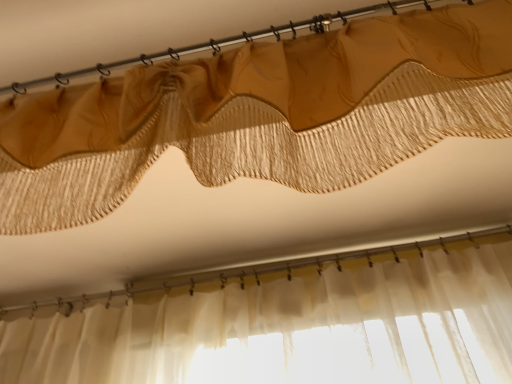
The image size is (512, 384). What do you see at coordinates (262, 114) in the screenshot? I see `matte gold curtain at upper center` at bounding box center [262, 114].

This screenshot has height=384, width=512. Identify the location of matte gold curtain at upper center. (262, 114).

You are a GUI agent. You are given a task and a screenshot of the screen. Output one action in this format:
    pyautogui.click(x=<x>, y=<y>)
    Task: Click on the matte gold curtain at upper center
    This screenshot has height=384, width=512.
    Given the screenshot: What is the action you would take?
    pyautogui.click(x=217, y=44)

The height and width of the screenshot is (384, 512). Describe the element at coordinates (217, 44) in the screenshot. I see `matte gold curtain at upper center` at that location.

Where is `matte gold curtain at upper center`? matte gold curtain at upper center is located at coordinates (262, 114).

Considering the relative positions of matte gold curtain at upper center and matte gold curtain at upper center in the image provided, is matte gold curtain at upper center to the right of matte gold curtain at upper center from the viewer's perspective?

Yes, matte gold curtain at upper center is to the right of matte gold curtain at upper center.

Which object is closer to the camera, matte gold curtain at upper center or matte gold curtain at upper center?

Positioned in front is matte gold curtain at upper center.

Is point (486, 11) closer or farther from the camera than point (430, 1)?

Point (486, 11) is positioned closer to the camera compared to point (430, 1).

From the image's perspective, is matte gold curtain at upper center located beneath matte gold curtain at upper center?

Yes, from the image's perspective, matte gold curtain at upper center is beneath matte gold curtain at upper center.

Based on the photo, from a real-world perspective, between matte gold curtain at upper center and matte gold curtain at upper center, who is vertically higher?

matte gold curtain at upper center.

Between matte gold curtain at upper center and matte gold curtain at upper center, which one has smaller width?

matte gold curtain at upper center is thinner.

Which of these two, matte gold curtain at upper center or matte gold curtain at upper center, stands taller?

With more height is matte gold curtain at upper center.

Considering the relative sizes of matte gold curtain at upper center and matte gold curtain at upper center in the image provided, is matte gold curtain at upper center bigger than matte gold curtain at upper center?

Correct, matte gold curtain at upper center is larger in size than matte gold curtain at upper center.

Is matte gold curtain at upper center completely or partially outside of matte gold curtain at upper center?

Yes, matte gold curtain at upper center is located beyond the bounds of matte gold curtain at upper center.

Is matte gold curtain at upper center directly adjacent to matte gold curtain at upper center?

No, matte gold curtain at upper center is not with matte gold curtain at upper center.

Based on the photo, is matte gold curtain at upper center aimed at matte gold curtain at upper center?

No, matte gold curtain at upper center is not facing towards matte gold curtain at upper center.

How different are the orientations of matte gold curtain at upper center and matte gold curtain at upper center in degrees?

The angular difference between matte gold curtain at upper center and matte gold curtain at upper center is 1.1 degrees.

You are a GUI agent. You are given a task and a screenshot of the screen. Output one action in this format:
    pyautogui.click(x=<x>, y=<y>)
    Task: Click on the curtain directly beneath the matte gold curtain at upper center (from a real-world perspective)
    
    Given the screenshot: What is the action you would take?
    pyautogui.click(x=262, y=114)

Looking at this image, is matte gold curtain at upper center to the right of matte gold curtain at upper center from the viewer's perspective?

No.

Between matte gold curtain at upper center and matte gold curtain at upper center, which one is positioned in front?

matte gold curtain at upper center is more forward.

Which is in front, point (383, 6) or point (468, 89)?

The point (468, 89) is closer.

From the image's perspective, is matte gold curtain at upper center below matte gold curtain at upper center?

No.

From a real-world perspective, is matte gold curtain at upper center physically below matte gold curtain at upper center?

No, from a real-world perspective, matte gold curtain at upper center is not under matte gold curtain at upper center.

Can you confirm if matte gold curtain at upper center is wider than matte gold curtain at upper center?

Yes, matte gold curtain at upper center is wider than matte gold curtain at upper center.

Who is shorter, matte gold curtain at upper center or matte gold curtain at upper center?

matte gold curtain at upper center.

Does matte gold curtain at upper center have a larger size compared to matte gold curtain at upper center?

No.

Is matte gold curtain at upper center positioned beyond the bounds of matte gold curtain at upper center?

Yes, matte gold curtain at upper center is not within matte gold curtain at upper center.

Would you say matte gold curtain at upper center is a long distance from matte gold curtain at upper center?

No.

Is matte gold curtain at upper center facing away from matte gold curtain at upper center?

matte gold curtain at upper center does not have its back to matte gold curtain at upper center.

What's the angular difference between matte gold curtain at upper center and matte gold curtain at upper center's facing directions?

The angular difference between matte gold curtain at upper center and matte gold curtain at upper center is 1.1 degrees.

At what (x,y) coordinates should I click in order to perform the action: click on curtain on the right of the matte gold curtain at upper center. Please return your answer as a coordinate pair (x, y). Looking at the image, I should click on (262, 114).

Find the location of a particular element. This screenshot has height=384, width=512. curtain that appears below the matte gold curtain at upper center (from a real-world perspective) is located at coordinates (262, 114).

Find the location of a particular element. clothesline lying above the matte gold curtain at upper center (from the image's perspective) is located at coordinates (217, 44).